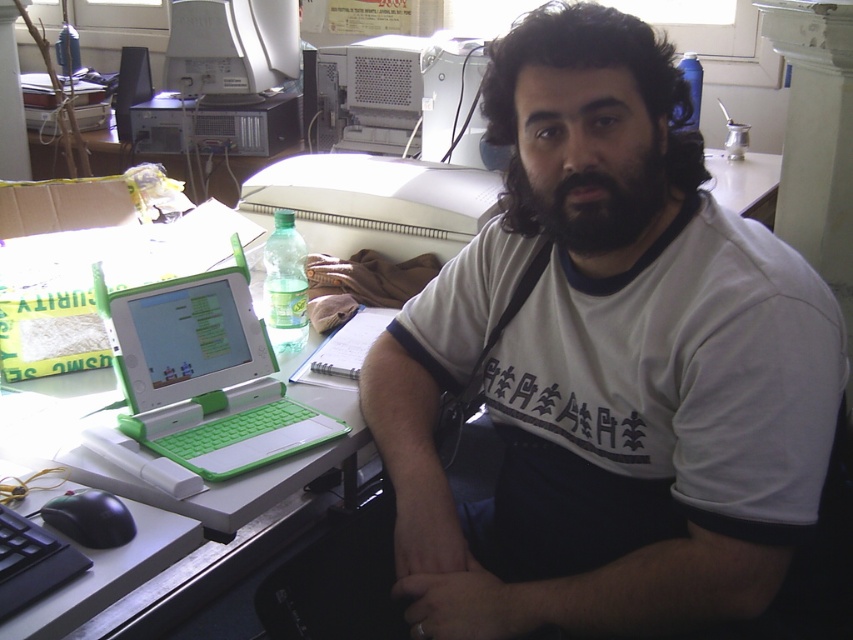
You need to place a 15 cm wide object on the desk. Which area would be suitable between the dark blue fabric at lower center and the white plastic desktop computer at upper center?

The white plastic desktop computer at upper center has a wider area than the dark blue fabric at lower center, so placing the 15 cm wide object on the white plastic desktop computer at upper center would be more suitable.